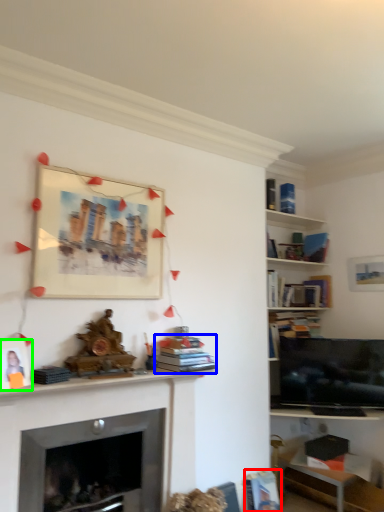
Question: Based on their relative distances, which object is farther from book (highlighted by a red box)? Choose from book (highlighted by a blue box) and picture frame (highlighted by a green box).

Choices:
 (A) book
 (B) picture frame

Answer: (B)